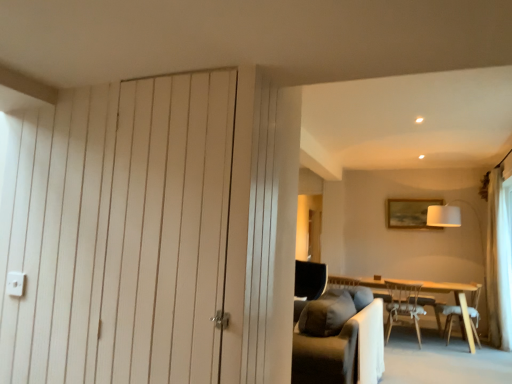
Question: Is light brown wooden chair at lower right, the 1th chair viewed from the left, inside or outside of light wood table at center?

Choices:
 (A) outside
 (B) inside

Answer: (B)

Question: From the image's perspective, is light brown wooden chair at lower right, which is counted as the second chair, starting from the right, located above or below light wood table at center?

Choices:
 (A) below
 (B) above

Answer: (B)

Question: Estimate the real-world distances between objects in this image. Which object is closer to the white fabric lampshade at upper right?

Choices:
 (A) wooden chair at lower right, marked as the first chair in a right-to-left arrangement
 (B) wooden framed picture at upper right
 (C) light wood table at center
 (D) white wood door at left
 (E) light brown wooden chair at lower right, which is counted as the second chair, starting from the right

Answer: (B)

Question: Based on their relative distances, which object is farther from the light wood table at center?

Choices:
 (A) wooden chair at lower right, marked as the first chair in a right-to-left arrangement
 (B) white fabric lampshade at upper right
 (C) wooden framed picture at upper right
 (D) light brown wooden chair at lower right, the 1th chair viewed from the left
 (E) white wood door at left

Answer: (E)